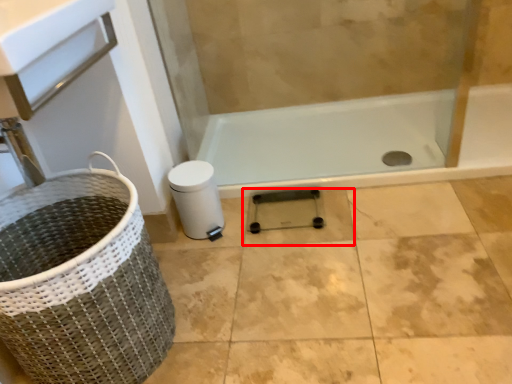
Question: From the image's perspective, considering the relative positions of tile (annotated by the red box) and basket container in the image provided, where is tile (annotated by the red box) located with respect to the staircase?

Choices:
 (A) above
 (B) below

Answer: (A)